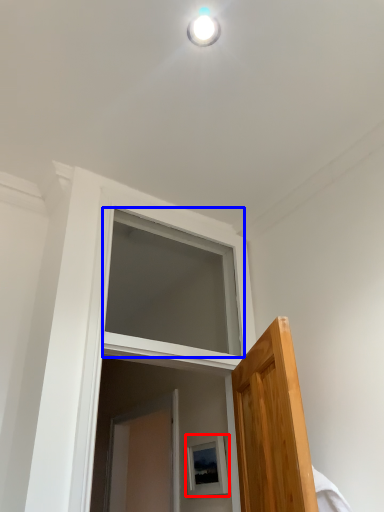
Question: Which object is further to the camera taking this photo, picture frame (highlighted by a red box) or window (highlighted by a blue box)?

Choices:
 (A) picture frame
 (B) window

Answer: (A)